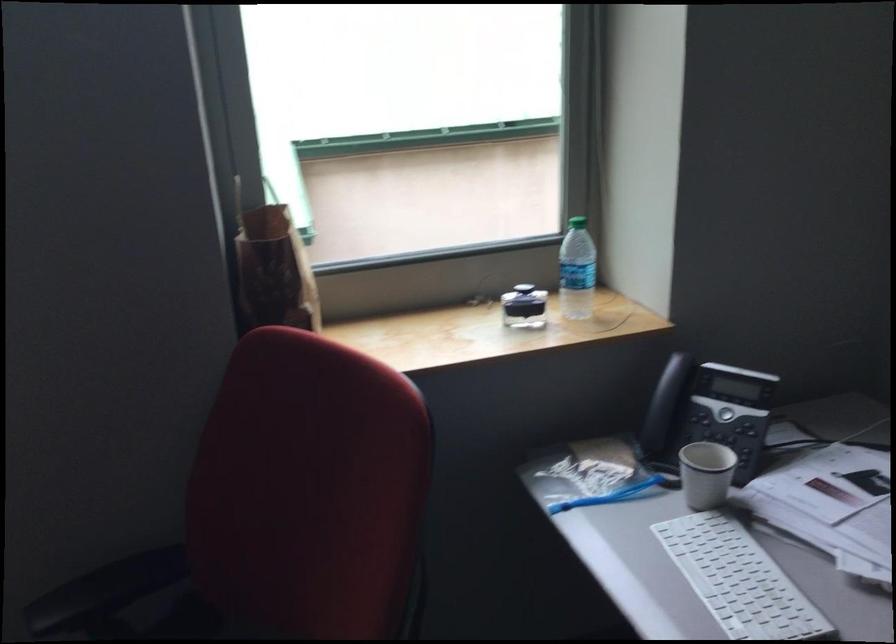
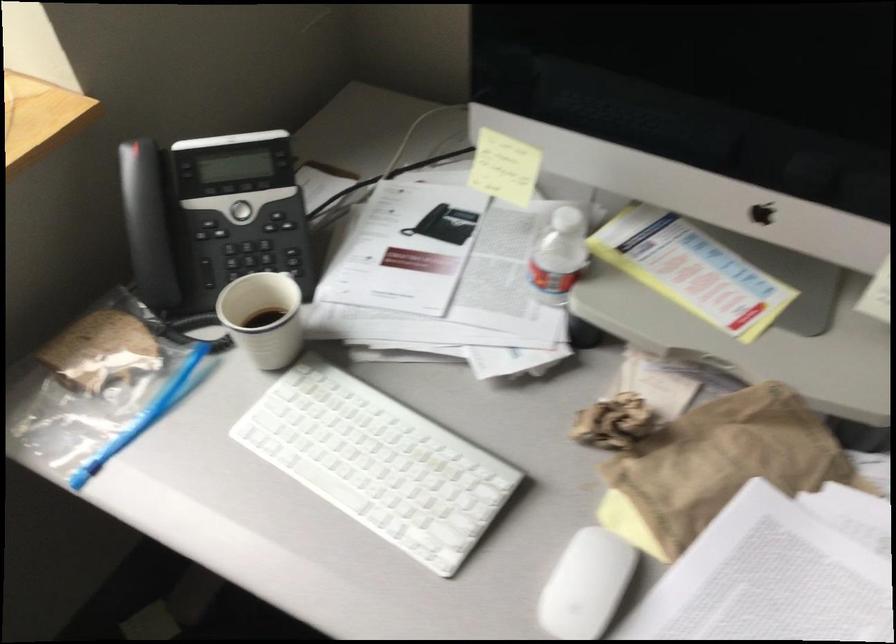
Find the pixel in the second image that matches the point at 734,442 in the first image.

(259, 250)